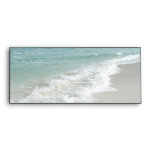
The width and height of the screenshot is (152, 152). What are the coordinates of `foam` in the screenshot? It's located at tap(92, 86).